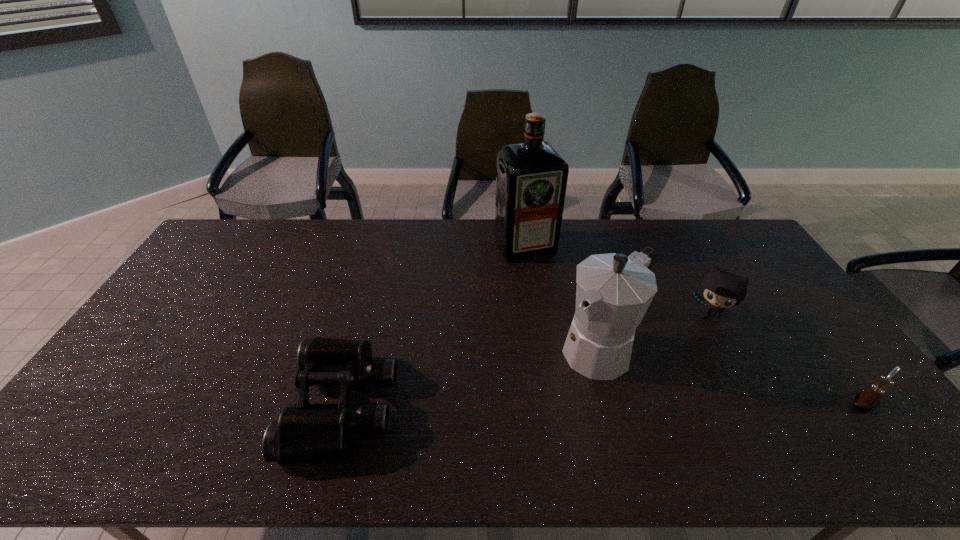
Find the location of a particular element. This screenshot has height=540, width=960. free space between the leftmost object and the farthest object is located at coordinates (434, 326).

The image size is (960, 540). In order to click on free point between the liquor and the coffeepot in this screenshot , I will do `click(564, 298)`.

Locate an element on the screen. The height and width of the screenshot is (540, 960). vacant point located between the leftmost object and the fourth object from left to right is located at coordinates (526, 361).

Find the location of a particular element. The height and width of the screenshot is (540, 960). free space between the third shortest object and the second tallest object is located at coordinates (656, 333).

The width and height of the screenshot is (960, 540). I want to click on unoccupied area between the rightmost object and the fourth object from left to right, so click(787, 360).

Where is `vacant space that is in between the second tallest object and the second object from right to left`? The height and width of the screenshot is (540, 960). vacant space that is in between the second tallest object and the second object from right to left is located at coordinates (656, 333).

You are a GUI agent. You are given a task and a screenshot of the screen. Output one action in this format:
    pyautogui.click(x=<x>, y=<y>)
    Task: Click on the free space between the fourth object from left to right and the second tallest object
    The height and width of the screenshot is (540, 960).
    Given the screenshot: What is the action you would take?
    pyautogui.click(x=656, y=333)

Locate an element on the screen. The width and height of the screenshot is (960, 540). object that is the closest to the fourth shortest object is located at coordinates (721, 289).

Locate which object is the second closest to the fourth object from left to right. Please provide its 2D coordinates. Your answer should be formatted as a tuple, i.e. [(x, y)], where the tuple contains the x and y coordinates of a point satisfying the conditions above.

[(867, 400)]